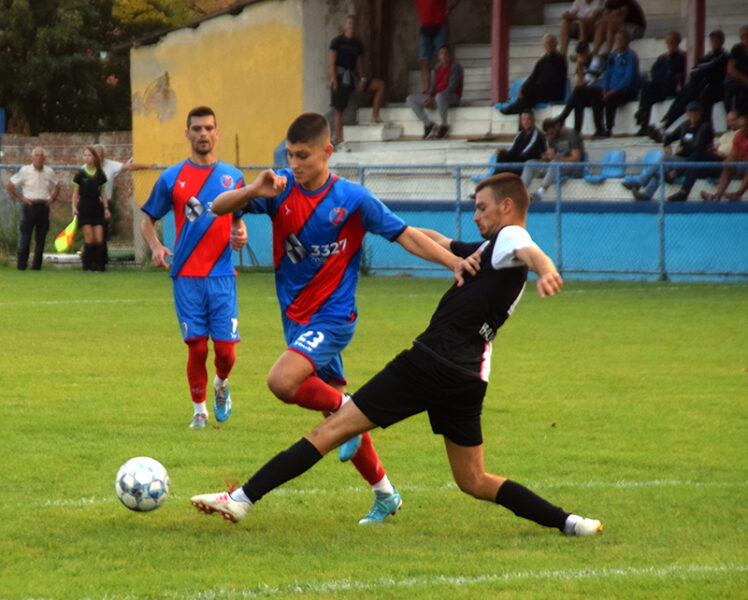
Locate an element on the screen. Image resolution: width=748 pixels, height=600 pixels. blue chair is located at coordinates (615, 163).